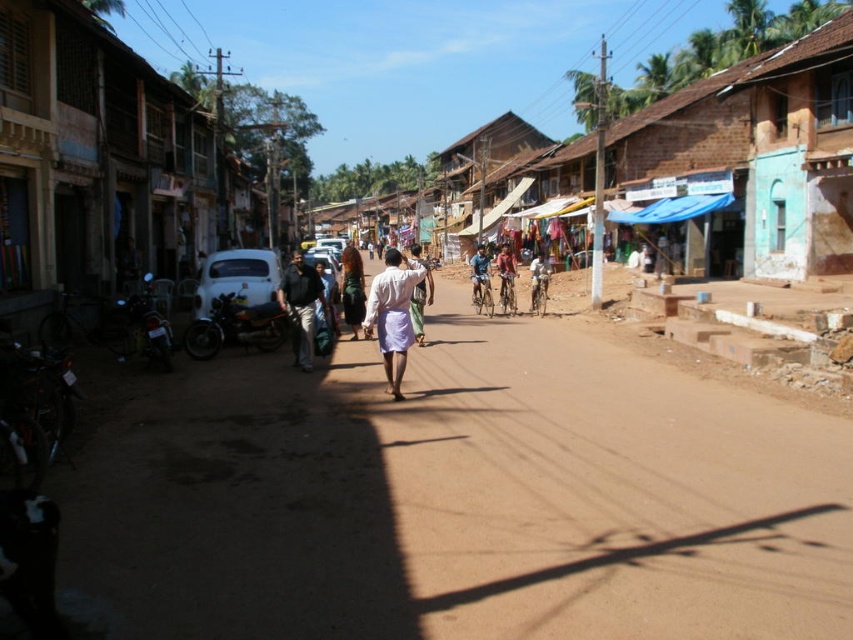
You are a traveler standing on the dusty street, and you see the white painted wood hut at left and the black cotton shirt at center. Which object is bigger in size?

The white painted wood hut at left is larger in size compared to the black cotton shirt at center.